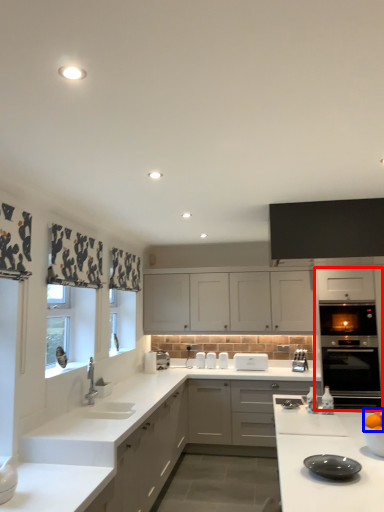
Question: Which object appears closest to the camera in this image, oven (highlighted by a red box) or orange (highlighted by a blue box)?

Choices:
 (A) oven
 (B) orange

Answer: (B)